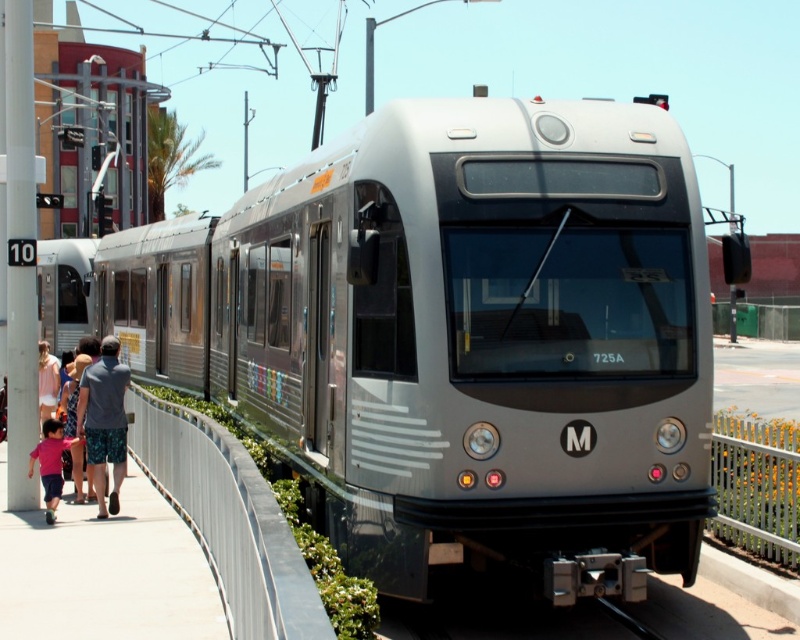
Is point (52, 493) positioned behind point (48, 388)?

No.

Can you confirm if pink fabric shirt at lower left is positioned below matte pink shirt at lower left?

Correct, pink fabric shirt at lower left is located below matte pink shirt at lower left.

Which is behind, point (61, 429) or point (38, 353)?

Positioned behind is point (38, 353).

Identify the location of pink fabric shirt at lower left. (52, 464).

Is point (332, 193) positioned after point (104, 461)?

That is False.

The width and height of the screenshot is (800, 640). Describe the element at coordinates (458, 337) in the screenshot. I see `satin silver train at center` at that location.

You are a GUI agent. You are given a task and a screenshot of the screen. Output one action in this format:
    pyautogui.click(x=<x>, y=<y>)
    Task: Click on the satin silver train at center
    This screenshot has height=640, width=800.
    Given the screenshot: What is the action you would take?
    pos(458,337)

Who is more forward, (426, 120) or (44, 396)?

Point (426, 120) is more forward.

Image resolution: width=800 pixels, height=640 pixels. What do you see at coordinates (458, 337) in the screenshot?
I see `satin silver train at center` at bounding box center [458, 337].

Is point (560, 218) positioned in front of point (44, 401)?

Yes, point (560, 218) is closer to viewer.

Locate an element on the screen. Image resolution: width=800 pixels, height=640 pixels. satin silver train at center is located at coordinates (458, 337).